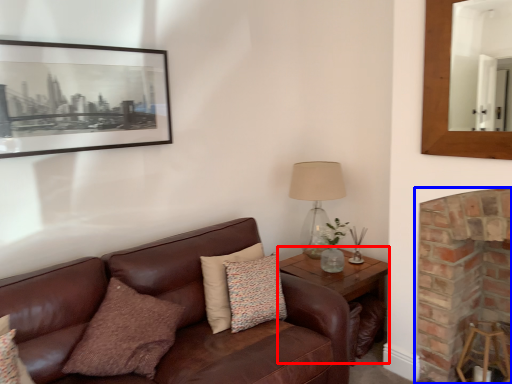
Question: Which point is closer to the camera, table (highlighted by a red box) or fireplace (highlighted by a blue box)?

Choices:
 (A) table
 (B) fireplace

Answer: (B)